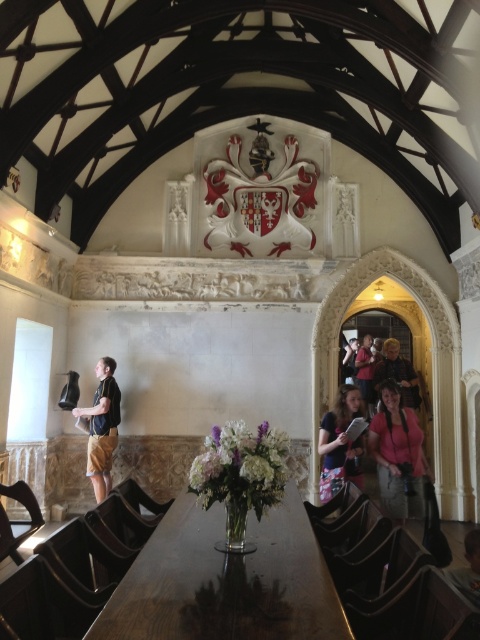
You are standing in the historic building and want to take a photo of both the matte black shirt at left and the matte black jacket at lower right. Which one should you focus on first to ensure both are in clear view?

You should focus on the matte black shirt at left first because it is closer to the viewer than the matte black jacket at lower right, ensuring both are in focus when using depth of field.

You are standing in the historic building and want to place a small vase on the wooden table at center. However, there is a person wearing a matte black shirt at left blocking your path. To reach the table, you need to walk around them. Which direction should you go to avoid the person?

You should walk around the person wearing the matte black shirt at left towards the wooden table at center since the table is closer to you than the person, meaning the person is further away and you can navigate around them by moving either to your right or left side.